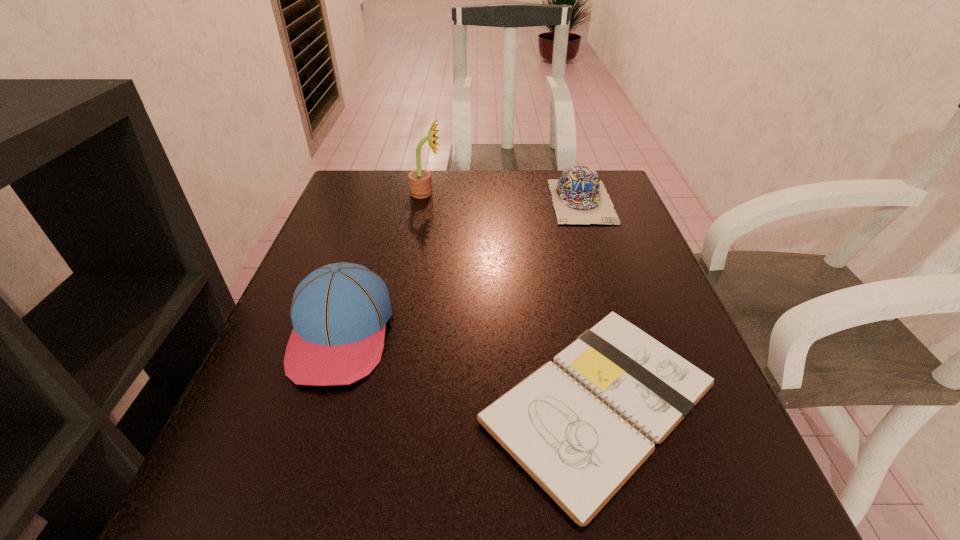
Where is `free space between the third shortest object and the sunflower`? Image resolution: width=960 pixels, height=540 pixels. free space between the third shortest object and the sunflower is located at coordinates (384, 263).

You are a GUI agent. You are given a task and a screenshot of the screen. Output one action in this format:
    pyautogui.click(x=<x>, y=<y>)
    Task: Click on the empty location between the sunflower and the second tallest object
    
    Given the screenshot: What is the action you would take?
    pyautogui.click(x=384, y=263)

The image size is (960, 540). In order to click on free space between the cap and the sunflower in this screenshot , I will do `click(504, 197)`.

The height and width of the screenshot is (540, 960). I want to click on the closest object to the second tallest object, so click(x=580, y=426).

Point out which object is positioned as the third nearest to the baseball cap. Please provide its 2D coordinates. Your answer should be formatted as a tuple, i.e. [(x, y)], where the tuple contains the x and y coordinates of a point satisfying the conditions above.

[(579, 197)]

The width and height of the screenshot is (960, 540). Find the location of `vacant space that satisfies the following two spatial constraints: 1. on the back side of the shortest object; 2. on the face of the tallest object`. vacant space that satisfies the following two spatial constraints: 1. on the back side of the shortest object; 2. on the face of the tallest object is located at coordinates (550, 193).

Locate an element on the screen. This screenshot has width=960, height=540. vacant space that satisfies the following two spatial constraints: 1. on the face of the tallest object; 2. on the front-facing side of the second tallest object is located at coordinates (401, 333).

Locate an element on the screen. vacant position in the image that satisfies the following two spatial constraints: 1. on the face of the notepad; 2. on the right side of the tallest object is located at coordinates (389, 402).

Where is `vacant point that satisfies the following two spatial constraints: 1. on the face of the sunflower; 2. on the back side of the notepad`? The height and width of the screenshot is (540, 960). vacant point that satisfies the following two spatial constraints: 1. on the face of the sunflower; 2. on the back side of the notepad is located at coordinates 389,402.

Find the location of a particular element. vacant space that satisfies the following two spatial constraints: 1. on the face of the shortest object; 2. on the left side of the tallest object is located at coordinates (389, 402).